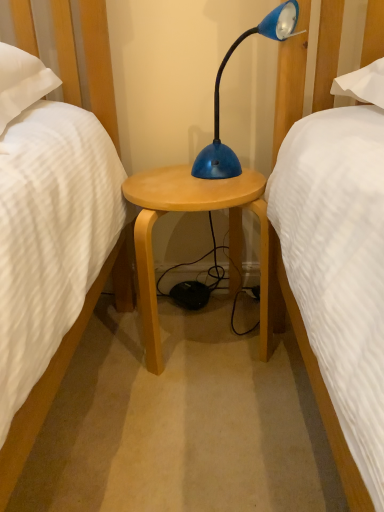
Where is `free space in front of blue glossy desk lamp at center`? This screenshot has height=512, width=384. free space in front of blue glossy desk lamp at center is located at coordinates (216, 187).